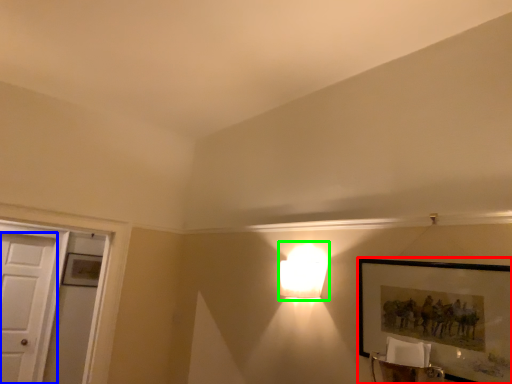
Question: Which object is positioned closest to picture frame (highlighted by a red box)? Select from door (highlighted by a blue box) and lamp (highlighted by a green box).

Choices:
 (A) door
 (B) lamp

Answer: (B)